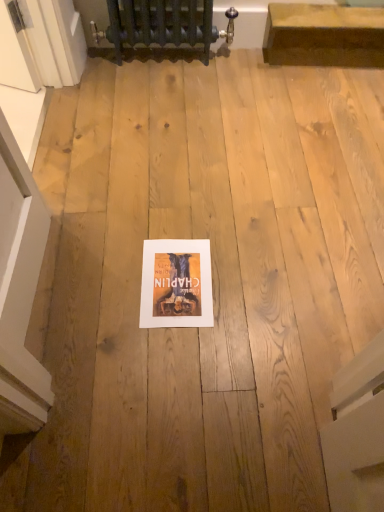
Where is `vacant area that lies in front of matte paper poster at center`? vacant area that lies in front of matte paper poster at center is located at coordinates (172, 353).